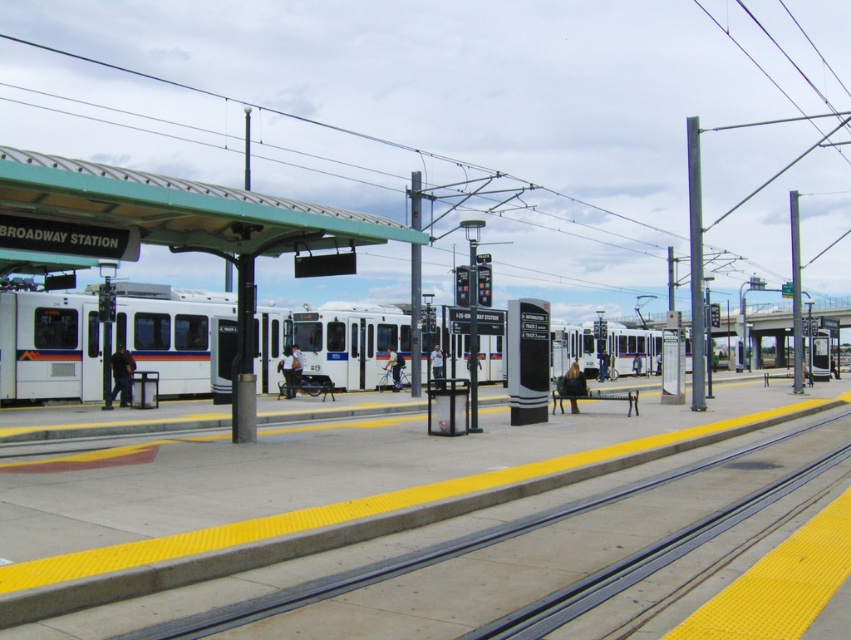
You are a passenger at Broadway Station waiting for the light rail train. You notice a point marked at coordinates (290, 369). What object is located at this point?

The point at coordinates (290, 369) is on the light brown leather jacket at center.

You are standing at the Broadway Station platform. There is a point marked at coordinates (49,346). What object does this point correspond to?

The point at coordinates (49,346) corresponds to the white matte train at left.